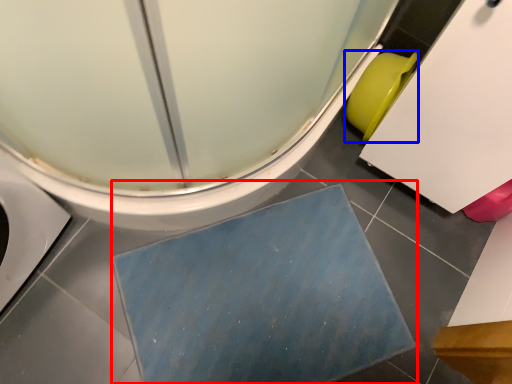
Question: Which object appears closest to the camera in this image, bath mat (highlighted by a red box) or toilet bowl (highlighted by a blue box)?

Choices:
 (A) bath mat
 (B) toilet bowl

Answer: (A)